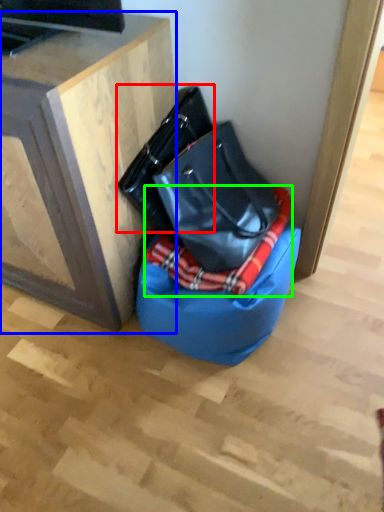
Question: Which is nearer to the handbag (highlighted by a red box)? furniture (highlighted by a blue box) or blanket (highlighted by a green box).

Choices:
 (A) furniture
 (B) blanket

Answer: (A)